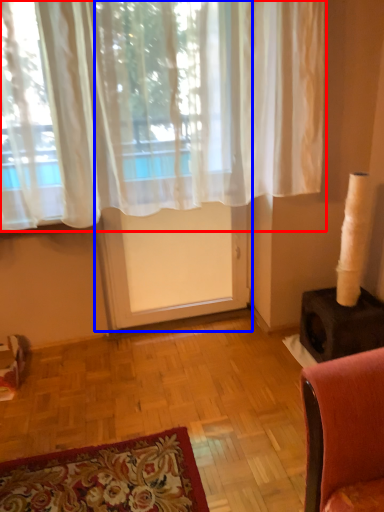
Question: Which of the following is the closest to the observer, curtain (highlighted by a red box) or screen door (highlighted by a blue box)?

Choices:
 (A) curtain
 (B) screen door

Answer: (A)